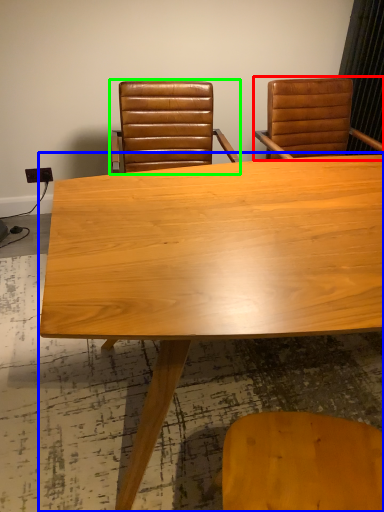
Question: Which object is positioned closest to chair (highlighted by a red box)? Select from table (highlighted by a blue box) and chair (highlighted by a green box).

Choices:
 (A) table
 (B) chair

Answer: (B)